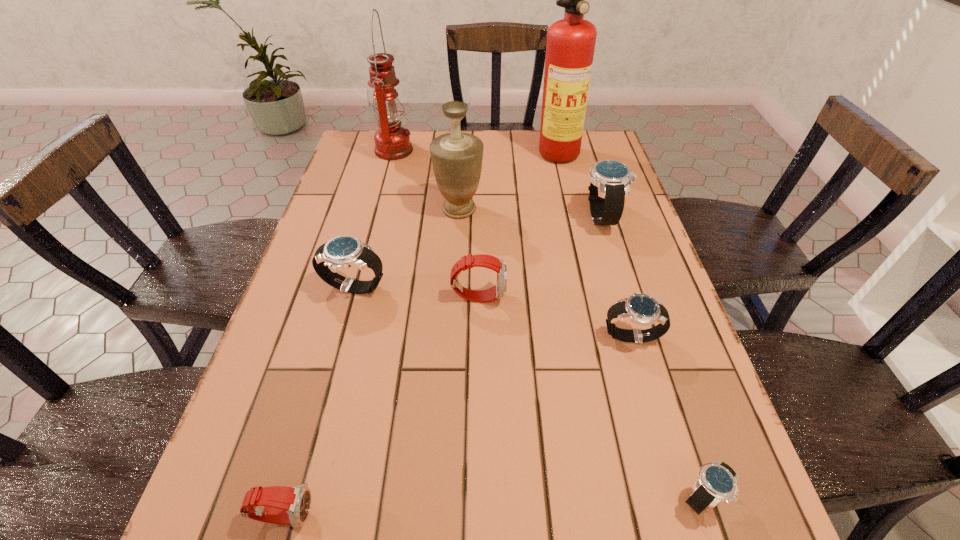
Where is `fire extinguisher located at the right edge`? This screenshot has width=960, height=540. fire extinguisher located at the right edge is located at coordinates (570, 46).

Find the location of a particular element. This screenshot has height=540, width=960. object that is at the far left corner is located at coordinates (392, 141).

The height and width of the screenshot is (540, 960). I want to click on object at the near left corner, so click(284, 505).

At what (x,y) coordinates should I click in order to perform the action: click on object at the far right corner. Please return your answer as a coordinate pair (x, y). Image resolution: width=960 pixels, height=540 pixels. Looking at the image, I should click on (570, 46).

The image size is (960, 540). In the image, there is a desktop. In order to click on vacant space at the far edge in this screenshot , I will do `click(538, 139)`.

In the image, there is a desktop. Where is `blank space at the left edge`? The width and height of the screenshot is (960, 540). blank space at the left edge is located at coordinates (348, 297).

In the image, there is a desktop. In order to click on vacant region at the right edge in this screenshot , I will do `click(597, 289)`.

Identify the location of vacant region at the far left corner of the desktop. (365, 133).

The image size is (960, 540). In the image, there is a desktop. What are the coordinates of `free space at the far right corner` in the screenshot? It's located at (580, 161).

You are a GUI agent. You are given a task and a screenshot of the screen. Output one action in this format:
    pyautogui.click(x=<x>, y=<y>)
    Task: Click on the vacant point located between the tallest object and the nearer red watch
    
    Given the screenshot: What is the action you would take?
    pyautogui.click(x=425, y=334)